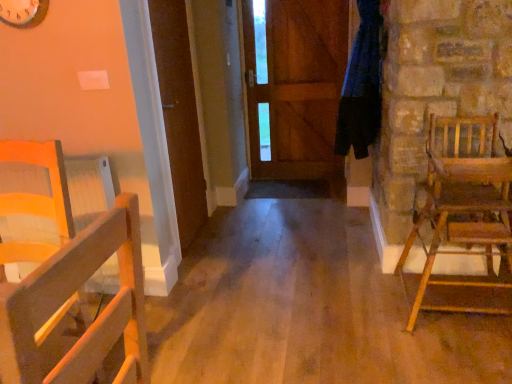
Locate an element on the screen. This screenshot has height=384, width=512. wooden clock at upper left is located at coordinates [23, 12].

The image size is (512, 384). What are the coordinates of `wooden chair at left, which is the second chair in right-to-left order` in the screenshot? It's located at (70, 282).

What are the coordinates of `wooden door at center, acting as the 2th door starting from the right` in the screenshot? It's located at [179, 115].

Where is `wooden door at center, marked as the 1th door in a back-to-front arrangement`? wooden door at center, marked as the 1th door in a back-to-front arrangement is located at coordinates (297, 86).

Which object is thinner, wooden door at center, the first door in the left-to-right sequence, or wooden clock at upper left?

Thinner between the two is wooden door at center, the first door in the left-to-right sequence.

From the image's perspective, relative to wooden clock at upper left, is wooden door at center, acting as the 2th door starting from the right, above or below?

Based on their image positions, wooden door at center, acting as the 2th door starting from the right, is located beneath wooden clock at upper left.

Who is bigger, wooden door at center, positioned as the 1th door in front-to-back order, or wooden clock at upper left?

wooden door at center, positioned as the 1th door in front-to-back order.

Does point (180, 98) appear closer or farther from the camera than point (2, 20)?

Point (180, 98).

From a real-world perspective, between wooden clock at upper left and blue fabric at right, who is vertically higher?

In real-world perspective, wooden clock at upper left is above.

Which object is closer to the camera, wooden clock at upper left or blue fabric at right?

wooden clock at upper left is more forward.

Are wooden clock at upper left and blue fabric at right located far from each other?

wooden clock at upper left is far away from blue fabric at right.

From the image's perspective, between wooden clock at upper left and blue fabric at right, which one is located above?

wooden clock at upper left, from the image's perspective.

Between wooden clock at upper left and wooden rocking chair at right, marked as the 1th chair in a right-to-left arrangement, which one has smaller width?

wooden clock at upper left is thinner.

From the picture: Is wooden rocking chair at right, marked as the 1th chair in a right-to-left arrangement, at the back of wooden clock at upper left?

No.

Identify the location of clock located on the left of wooden rocking chair at right, acting as the 2th chair starting from the left. pyautogui.click(x=23, y=12).

Is wooden clock at upper left located outside wooden rocking chair at right, marked as the 1th chair in a right-to-left arrangement?

wooden clock at upper left is positioned outside wooden rocking chair at right, marked as the 1th chair in a right-to-left arrangement.

Can you confirm if wooden chair at left, the first chair positioned from the left, is wider than blue fabric at right?

Incorrect, the width of wooden chair at left, the first chair positioned from the left, does not surpass that of blue fabric at right.

Between wooden chair at left, which is the second chair in right-to-left order, and blue fabric at right, which one appears on the right side from the viewer's perspective?

Positioned to the right is blue fabric at right.

Looking at this image, considering the relative positions of wooden chair at left, the first chair positioned from the left, and blue fabric at right in the image provided, is wooden chair at left, the first chair positioned from the left, behind blue fabric at right?

No, it is in front of blue fabric at right.

Find the location of a particular element. The height and width of the screenshot is (384, 512). the 2nd chair directly beneath the blue fabric at right (from a real-world perspective) is located at coordinates (70, 282).

From the picture: Is wooden door at center, which appears as the 1th door when viewed from the right, positioned far away from wooden clock at upper left?

wooden door at center, which appears as the 1th door when viewed from the right, is positioned a significant distance from wooden clock at upper left.

From the picture: Does wooden door at center, which appears as the 1th door when viewed from the right, have a larger size compared to wooden clock at upper left?

Yes, wooden door at center, which appears as the 1th door when viewed from the right, is bigger than wooden clock at upper left.

Between wooden door at center, which ranks as the second door in left-to-right order, and wooden clock at upper left, which one appears on the left side from the viewer's perspective?

From the viewer's perspective, wooden clock at upper left appears more on the left side.

Is point (269, 70) positioned before point (0, 18)?

No, it is not.

How far apart are wooden chair at left, the first chair positioned from the left, and wooden clock at upper left?

The distance of wooden chair at left, the first chair positioned from the left, from wooden clock at upper left is 39.17 inches.

Does wooden chair at left, the first chair positioned from the left, appear on the right side of wooden clock at upper left?

Yes.

In terms of height, does wooden chair at left, the first chair positioned from the left, look taller or shorter compared to wooden clock at upper left?

Clearly, wooden chair at left, the first chair positioned from the left, is taller compared to wooden clock at upper left.

Considering the relative sizes of wooden chair at left, the first chair positioned from the left, and wooden clock at upper left in the image provided, is wooden chair at left, the first chair positioned from the left, bigger than wooden clock at upper left?

Yes, wooden chair at left, the first chair positioned from the left, is bigger than wooden clock at upper left.

From a real-world perspective, is blue fabric at right located beneath wooden rocking chair at right, marked as the 1th chair in a right-to-left arrangement?

No, from a real-world perspective, blue fabric at right is not below wooden rocking chair at right, marked as the 1th chair in a right-to-left arrangement.

Would you consider blue fabric at right to be distant from wooden rocking chair at right, marked as the 1th chair in a right-to-left arrangement?

blue fabric at right is positioned a significant distance from wooden rocking chair at right, marked as the 1th chair in a right-to-left arrangement.

Can you confirm if blue fabric at right is positioned to the right of wooden rocking chair at right, acting as the 2th chair starting from the left?

In fact, blue fabric at right is to the left of wooden rocking chair at right, acting as the 2th chair starting from the left.

Considering the sizes of objects blue fabric at right and wooden rocking chair at right, acting as the 2th chair starting from the left, in the image provided, who is smaller, blue fabric at right or wooden rocking chair at right, acting as the 2th chair starting from the left,?

With smaller size is blue fabric at right.

Where is `clock above the wooden door at center, acting as the 2th door starting from the right (from a real-world perspective)`? This screenshot has width=512, height=384. clock above the wooden door at center, acting as the 2th door starting from the right (from a real-world perspective) is located at coordinates (23, 12).

You are a GUI agent. You are given a task and a screenshot of the screen. Output one action in this format:
    pyautogui.click(x=<x>, y=<y>)
    Task: Click on the clothesline on the right of wooden clock at upper left
    
    Given the screenshot: What is the action you would take?
    pyautogui.click(x=362, y=86)

Which object lies further to the anchor point blue fabric at right, wooden clock at upper left or wooden rocking chair at right, marked as the 1th chair in a right-to-left arrangement?

wooden clock at upper left.

Considering their positions, is wooden chair at left, the first chair positioned from the left, positioned further to wooden door at center, positioned as the 1th door in front-to-back order, than wooden door at center, arranged as the second door when viewed from the front?

wooden door at center, arranged as the second door when viewed from the front.

Looking at the image, which one is located further to wooden door at center, acting as the second door starting from the back, wooden clock at upper left or wooden door at center, marked as the 1th door in a back-to-front arrangement?

wooden door at center, marked as the 1th door in a back-to-front arrangement, is positioned further to the anchor wooden door at center, acting as the second door starting from the back.

Considering their positions, is blue fabric at right positioned further to wooden clock at upper left than wooden chair at left, which is the second chair in right-to-left order?

blue fabric at right is positioned further to the anchor wooden clock at upper left.

Looking at the image, which one is located closer to wooden door at center, which ranks as the second door in left-to-right order, blue fabric at right or wooden door at center, acting as the second door starting from the back?

blue fabric at right lies closer to wooden door at center, which ranks as the second door in left-to-right order, than the other object.

When comparing their distances from wooden clock at upper left, does wooden door at center, arranged as the second door when viewed from the front, or blue fabric at right seem further?

wooden door at center, arranged as the second door when viewed from the front.

Looking at the image, which one is located further to blue fabric at right, wooden chair at left, which is the second chair in right-to-left order, or wooden rocking chair at right, acting as the 2th chair starting from the left?

Among the two, wooden chair at left, which is the second chair in right-to-left order, is located further to blue fabric at right.

Which object lies further to the anchor point wooden door at center, which appears as the 1th door when viewed from the right, wooden chair at left, which is the second chair in right-to-left order, or blue fabric at right?

wooden chair at left, which is the second chair in right-to-left order.

Where is `door between wooden clock at upper left and wooden chair at left, which is the second chair in right-to-left order, in the up-down direction`? This screenshot has width=512, height=384. door between wooden clock at upper left and wooden chair at left, which is the second chair in right-to-left order, in the up-down direction is located at coordinates (179, 115).

Identify the location of chair between wooden clock at upper left and blue fabric at right from left to right. (70, 282).

Identify the location of clothesline situated between wooden door at center, positioned as the 1th door in front-to-back order, and wooden rocking chair at right, marked as the 1th chair in a right-to-left arrangement, from left to right. The width and height of the screenshot is (512, 384). (362, 86).

This screenshot has height=384, width=512. I want to click on clothesline between wooden door at center, positioned as the 1th door in front-to-back order, and wooden door at center, marked as the 1th door in a back-to-front arrangement, in the front-back direction, so click(362, 86).